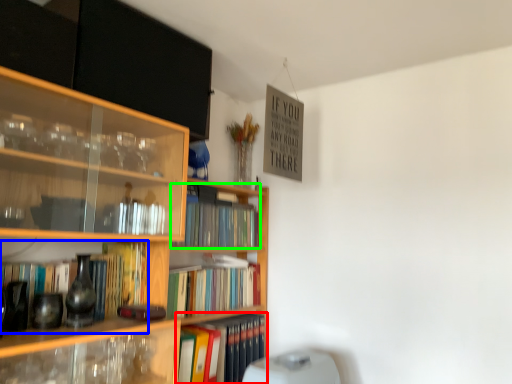
Question: Estimate the real-world distances between objects in this image. Which object is farther from book (highlighted by a red box), book (highlighted by a blue box) or book (highlighted by a green box)?

Choices:
 (A) book
 (B) book

Answer: (A)